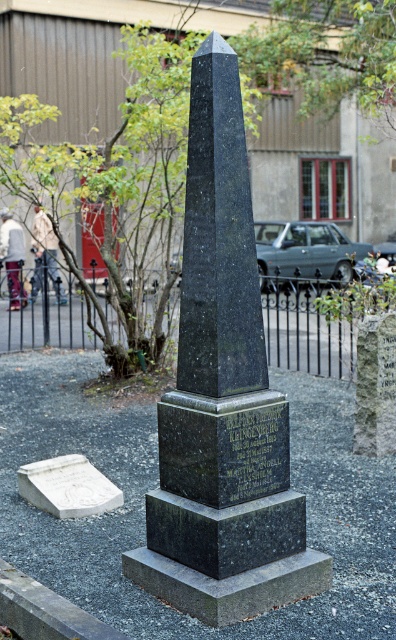
You are standing at the black marble obelisk monument at center. You see two points marked in the image, point (258,586) and point (57,460). Which point is closer to you?

Point (258,586) is in front of point (57,460), so it is closer to you.

You are standing in a cemetery and see the black granite obelisk at center and the white marble gravestone at lower left. Which object is taller?

The black granite obelisk at center is much taller than the white marble gravestone at lower left.

In the scene shown: You are a groundskeeper measuring the width of the black granite obelisk at center and the white marble gravestone at lower left. Which one do you think has a larger width?

The black granite obelisk at center might be wider than white marble gravestone at lower left.